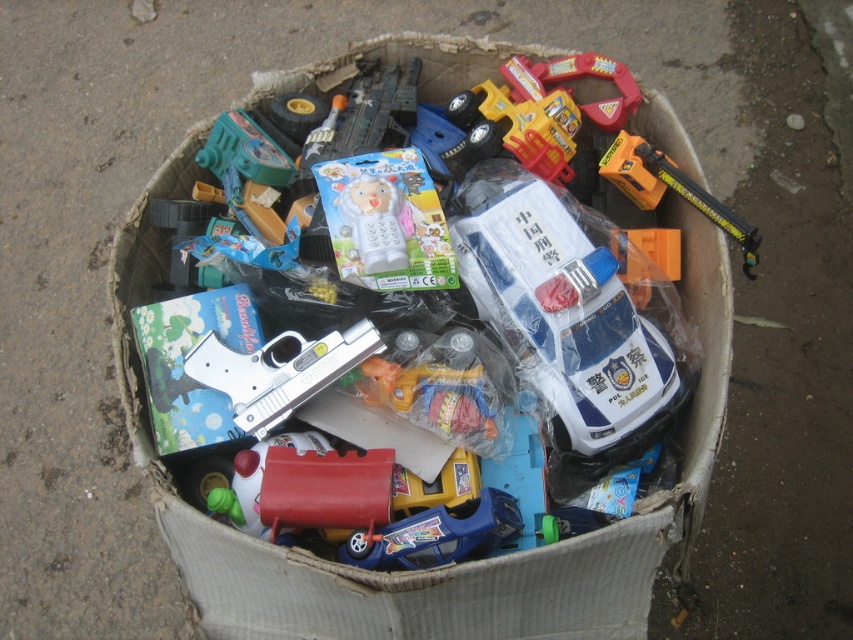
Between white cardboard box at center and white plastic phone at center, which one appears on the right side from the viewer's perspective?

From the viewer's perspective, white cardboard box at center appears more on the right side.

This screenshot has height=640, width=853. I want to click on white cardboard box at center, so click(x=430, y=570).

Is point (134, 272) less distant than point (355, 228)?

No, it is behind (355, 228).

This screenshot has width=853, height=640. I want to click on white cardboard box at center, so tap(430, 570).

Does white plastic police car at center have a lesser height compared to silver metallic toy gun at center?

Incorrect, white plastic police car at center's height does not fall short of silver metallic toy gun at center's.

In the scene shown: Can you confirm if white plastic police car at center is positioned to the left of silver metallic toy gun at center?

Incorrect, white plastic police car at center is not on the left side of silver metallic toy gun at center.

Who is more forward, (491, 182) or (219, 353)?

Point (219, 353) is in front.

At what (x,y) coordinates should I click in order to perform the action: click on white plastic police car at center. Please return your answer as a coordinate pair (x, y). The image size is (853, 640). Looking at the image, I should click on (561, 310).

Who is positioned more to the left, white cardboard box at center or white plastic police car at center?

From the viewer's perspective, white cardboard box at center appears more on the left side.

Is white cardboard box at center wider than white plastic police car at center?

Yes.

At what (x,y) coordinates should I click in order to perform the action: click on white cardboard box at center. Please return your answer as a coordinate pair (x, y). Looking at the image, I should click on (430, 570).